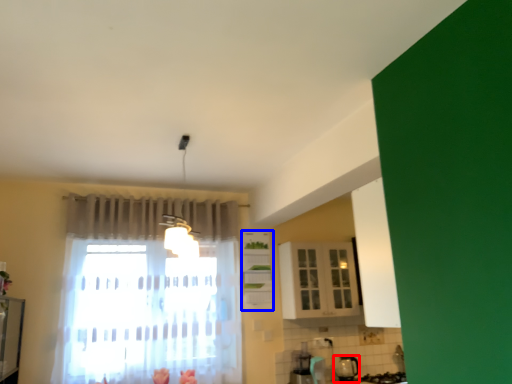
Question: Which of the following is the closest to the observer, appliance (highlighted by a red box) or cabinetry (highlighted by a blue box)?

Choices:
 (A) appliance
 (B) cabinetry

Answer: (A)